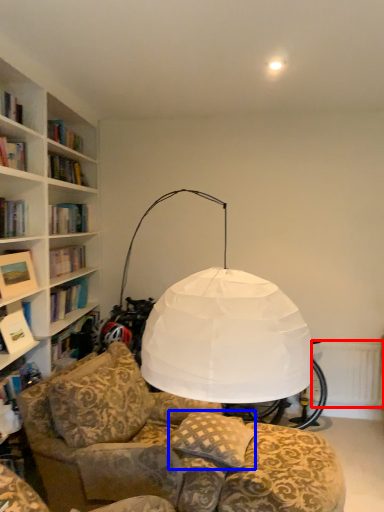
Question: Which of the following is the farthest to the observer, radiator (highlighted by a red box) or pillow (highlighted by a blue box)?

Choices:
 (A) radiator
 (B) pillow

Answer: (A)